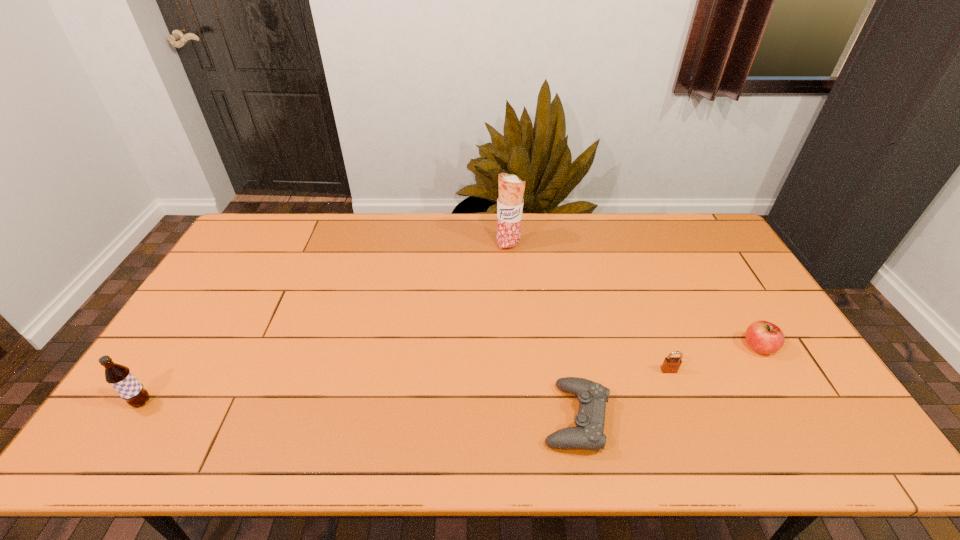
Locate an element on the screen. free space located on the left of the tallest object is located at coordinates (435, 245).

In order to click on free region located 0.340m on the back of the leftmost object in this screenshot , I will do point(208,299).

Where is `vacant position located 0.270m on the front of the rightmost object`? Image resolution: width=960 pixels, height=540 pixels. vacant position located 0.270m on the front of the rightmost object is located at coordinates (824, 456).

The image size is (960, 540). What are the coordinates of `vacant region located on the front-facing side of the third farthest object` in the screenshot? It's located at coord(701,454).

Find the location of a particular element. This screenshot has height=540, width=960. vacant space positioned 0.270m on the left of the shortest object is located at coordinates (430, 418).

The image size is (960, 540). In order to click on object located at the far edge in this screenshot , I will do `click(511, 188)`.

The image size is (960, 540). Find the location of `object located at the near edge`. object located at the near edge is located at coordinates (588, 434).

In order to click on object located at the left edge in this screenshot , I will do `click(122, 380)`.

At what (x,y) coordinates should I click in order to perform the action: click on object located in the right edge section of the desktop. Please return your answer as a coordinate pair (x, y). This screenshot has width=960, height=540. Looking at the image, I should click on (764, 337).

This screenshot has width=960, height=540. I want to click on vacant space at the far edge of the desktop, so click(622, 223).